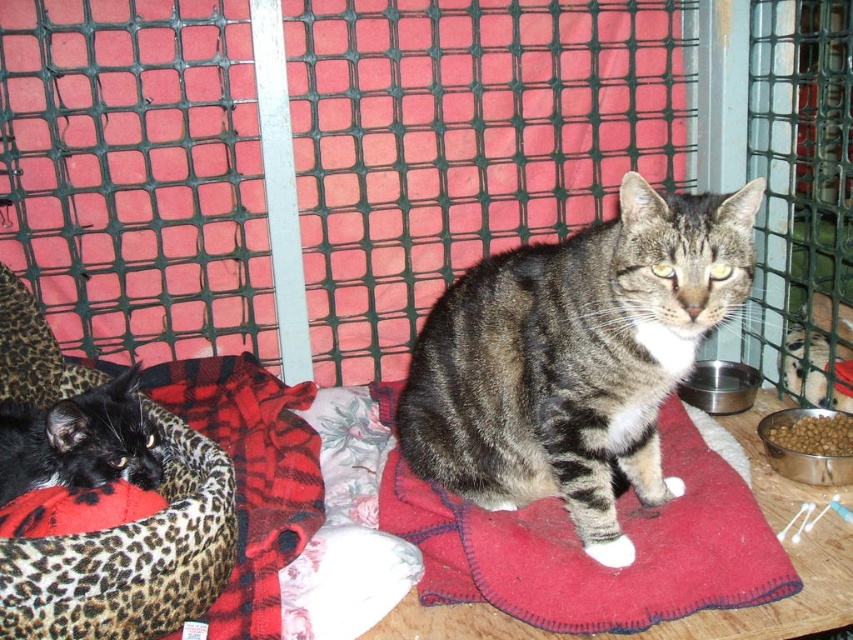
Question: Can you confirm if tabby fur cat at center is positioned to the right of soft woolen mat at center?

Choices:
 (A) yes
 (B) no

Answer: (A)

Question: Does soft woolen mat at center have a smaller size compared to black fur cat at left?

Choices:
 (A) yes
 (B) no

Answer: (B)

Question: Which object is the closest to the brown matte food at lower right?

Choices:
 (A) soft woolen mat at center
 (B) black fur cat at left

Answer: (A)

Question: Does black fur cat at left have a larger size compared to brown matte food at lower right?

Choices:
 (A) no
 (B) yes

Answer: (B)

Question: Which object is positioned closest to the brown matte food at lower right?

Choices:
 (A) black fur cat at left
 (B) soft woolen mat at center

Answer: (B)

Question: Which of the following is the closest to the observer?

Choices:
 (A) brown matte food at lower right
 (B) black fur cat at left
 (C) tabby fur cat at center
 (D) soft woolen mat at center

Answer: (D)